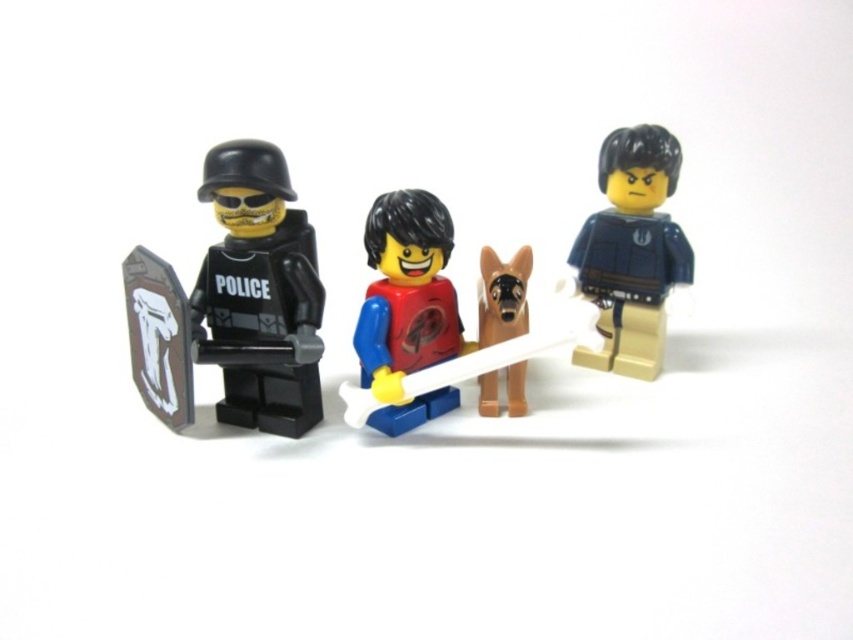
You are a LEGO collector trying to assemble a scene where the matte black police officer at left and the blue matte shirt at center are positioned correctly. According to the image, which minifigure should be placed closer to the front?

The matte black police officer at left should be placed closer to the front because it is in front of the blue matte shirt at center.

You are a LEGO collector who wants to display the matte black police officer at left and the blue matte shirt at center on a shelf. If you want to arrange them so that the taller one is placed first, which minifigure should you place first?

The matte black police officer at left is taller than the blue matte shirt at center, so you should place the matte black police officer at left first.